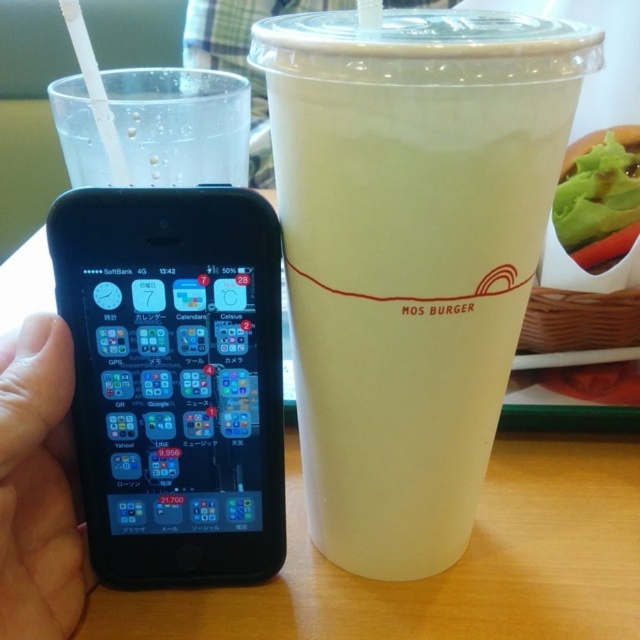
In the scene shown: You are a delivery person who needs to place a small package between the white opaque cup at center and the white plastic straw at upper left. The package is 10 inches long. Can you fit it between them without moving either item?

The distance between the white opaque cup at center and the white plastic straw at upper left is 9.74 inches. Since the package is 10 inches long, it cannot fit between them without moving either item.

You are placing a new decorative item on the wooden table at center. If the table is represented by coordinates, where exactly should you place it according to the given coordinates?

The wooden table at center should be placed at the coordinates point (445,570) as specified in the description.